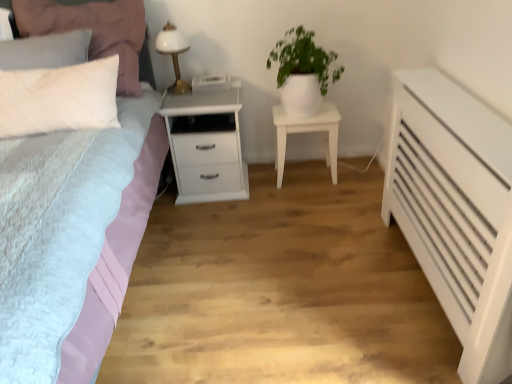
You are a GUI agent. You are given a task and a screenshot of the screen. Output one action in this format:
    pyautogui.click(x=<x>, y=<y>)
    Task: Click on the empty space that is ontop of white glossy nightstand at center, which appears as the second nightstand when viewed from the right (from a real-world perspective)
    The height and width of the screenshot is (384, 512).
    Given the screenshot: What is the action you would take?
    pyautogui.click(x=203, y=90)